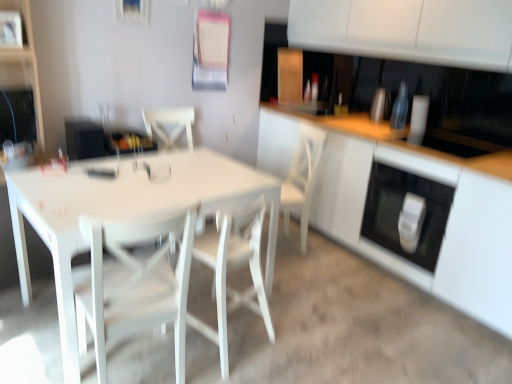
You are a GUI agent. You are given a task and a screenshot of the screen. Output one action in this format:
    pyautogui.click(x=<x>, y=<y>)
    Task: Click on the vacant space to the right of white wood chair at center
    The width and height of the screenshot is (512, 384).
    Given the screenshot: What is the action you would take?
    pyautogui.click(x=333, y=254)